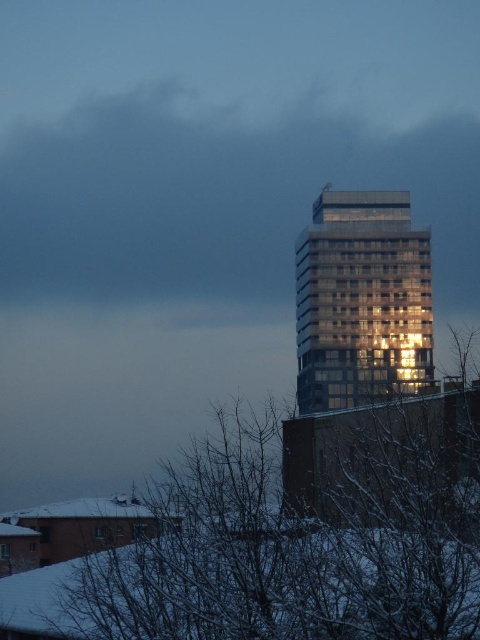
You are an architect analyzing the winter scene. You need to determine which object takes up more visual space in the image between the snowy branches at lower right and the reflective glass building at center. Which one is larger in the image?

The reflective glass building at center occupies more visual space than the snowy branches at lower right, as stated in the description that the snowy branches at lower right occupies less space than reflective glass building at center.